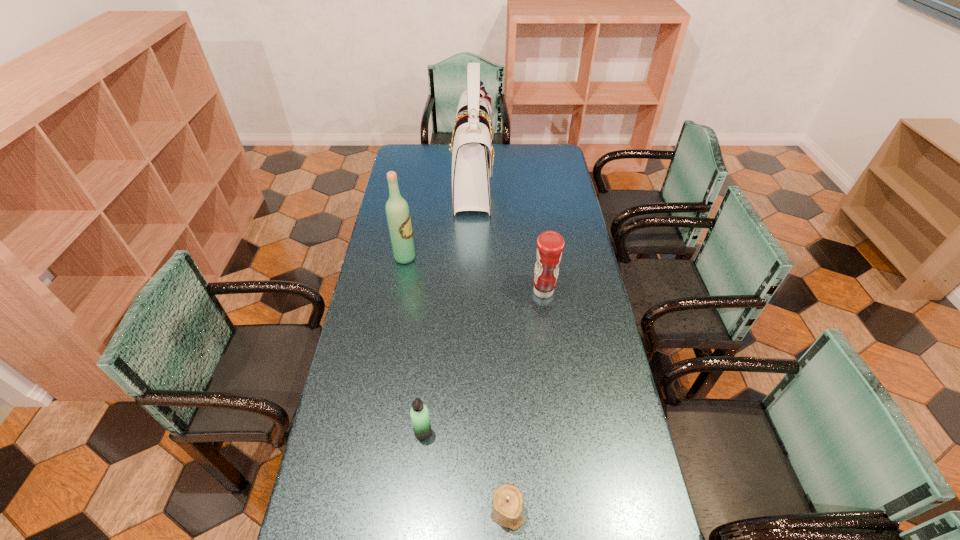
I want to click on satchel, so click(472, 154).

Locate an element on the screen. the farthest object is located at coordinates (472, 154).

At what (x,y) coordinates should I click in order to perform the action: click on the leftmost object. Please return your answer as a coordinate pair (x, y). This screenshot has height=540, width=960. Looking at the image, I should click on (397, 211).

Locate an element on the screen. the fourth nearest object is located at coordinates (397, 211).

What are the coordinates of `the third nearest object` in the screenshot? It's located at (550, 244).

Where is `the rightmost object`? The width and height of the screenshot is (960, 540). the rightmost object is located at coordinates (550, 244).

At what (x,y) coordinates should I click in order to perform the action: click on the second shortest object. Please return your answer as a coordinate pair (x, y). Image resolution: width=960 pixels, height=540 pixels. Looking at the image, I should click on (419, 414).

At what (x,y) coordinates should I click in order to perform the action: click on thermos bottle. Please return your answer as a coordinate pair (x, y). Looking at the image, I should click on (419, 414).

Where is `the shortest object`? the shortest object is located at coordinates (507, 505).

I want to click on the nearest object, so click(507, 505).